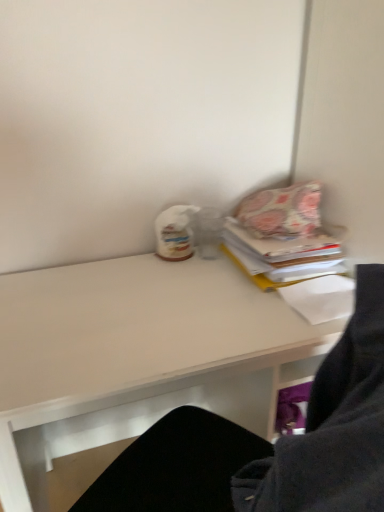
Find the location of a particular element. This screenshot has width=384, height=512. free space in front of patterned fabric book at upper right is located at coordinates pos(243,315).